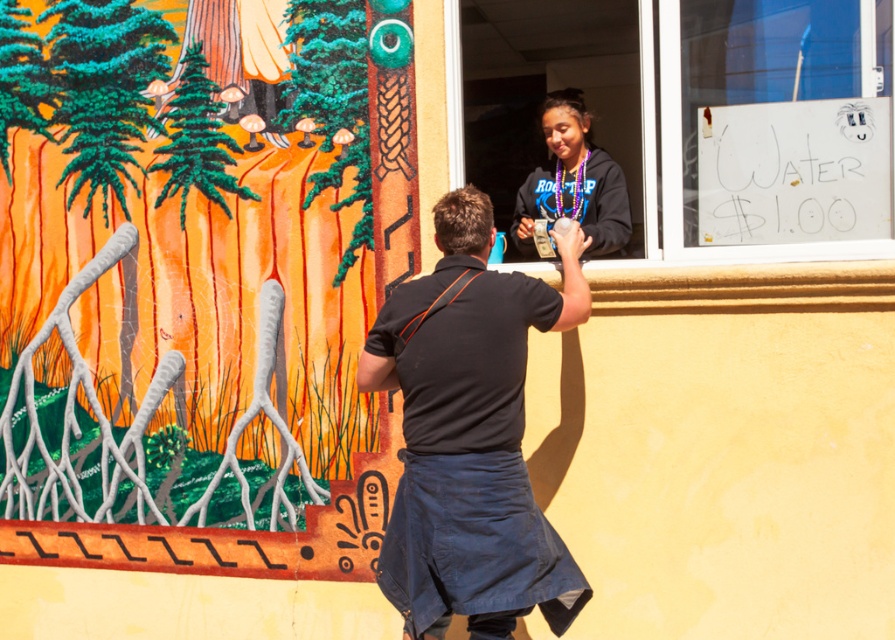
You are a painter standing in front of the image. You need to paint the matte orange wall at center and the transparent glass window at upper center. Which object should you paint first if you want to start with the one closer to the ground?

The matte orange wall at center should be painted first because it is positioned under the transparent glass window at upper center, meaning it is closer to the ground.